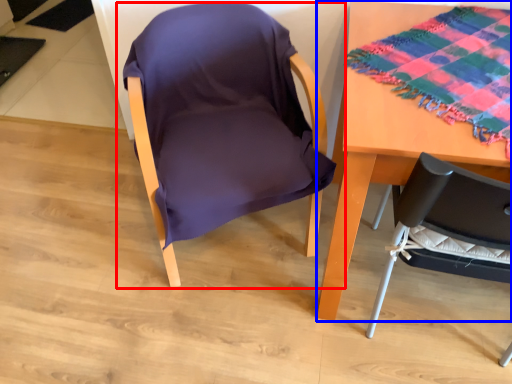
Question: Which point is closer to the camera, chair (highlighted by a red box) or table (highlighted by a blue box)?

Choices:
 (A) chair
 (B) table

Answer: (B)